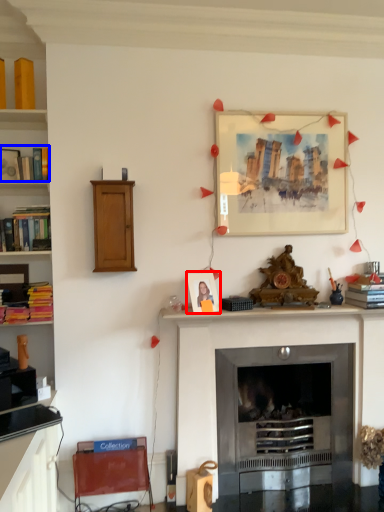
Question: Among these objects, which one is farthest to the camera, picture frame (highlighted by a red box) or book (highlighted by a blue box)?

Choices:
 (A) picture frame
 (B) book

Answer: (B)